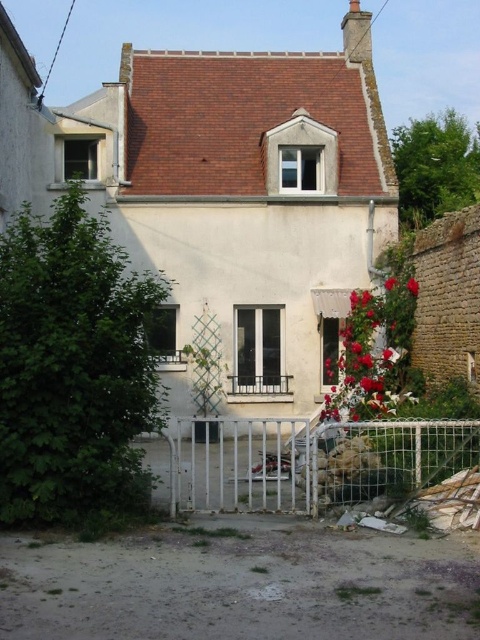
Is the position of white metal gate at lower center more distant than that of vivid red petals at center?

No.

Does white metal gate at lower center appear under vivid red petals at center?

Yes, white metal gate at lower center is below vivid red petals at center.

Is point (313, 506) farther from camera compared to point (354, 356)?

That is False.

Locate an element on the screen. Image resolution: width=480 pixels, height=640 pixels. white metal gate at lower center is located at coordinates (311, 461).